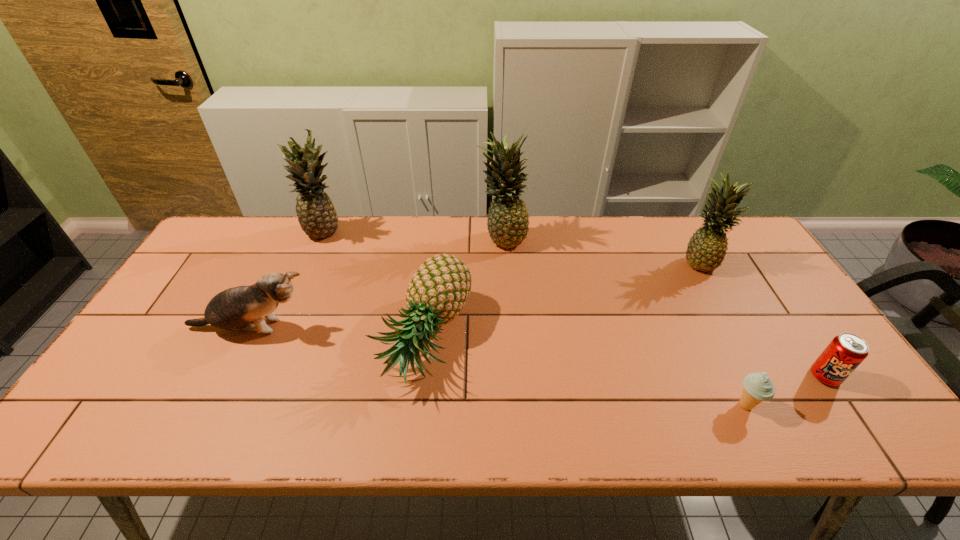
This screenshot has height=540, width=960. I want to click on the fourth object from left to right, so click(x=508, y=221).

Locate an element on the screen. This screenshot has height=540, width=960. the leftmost pineapple is located at coordinates (316, 214).

At what (x,y) coordinates should I click in order to perform the action: click on the rightmost pineapple. Please return your answer as a coordinate pair (x, y). Looking at the image, I should click on (706, 250).

What are the coordinates of `the third tallest pineapple` in the screenshot? It's located at (706, 250).

Where is `the fifth object from right to left`? Image resolution: width=960 pixels, height=540 pixels. the fifth object from right to left is located at coordinates (436, 294).

Find the location of `the third pineapple from right to left`. the third pineapple from right to left is located at coordinates (436, 294).

Find the location of a particular element. This screenshot has height=540, width=960. cat is located at coordinates (233, 309).

Where is `the rightmost object`? This screenshot has height=540, width=960. the rightmost object is located at coordinates (845, 352).

This screenshot has height=540, width=960. Identify the location of icecream. (758, 387).

I want to click on free location located 0.090m on the right of the fourth object from left to right, so click(555, 237).